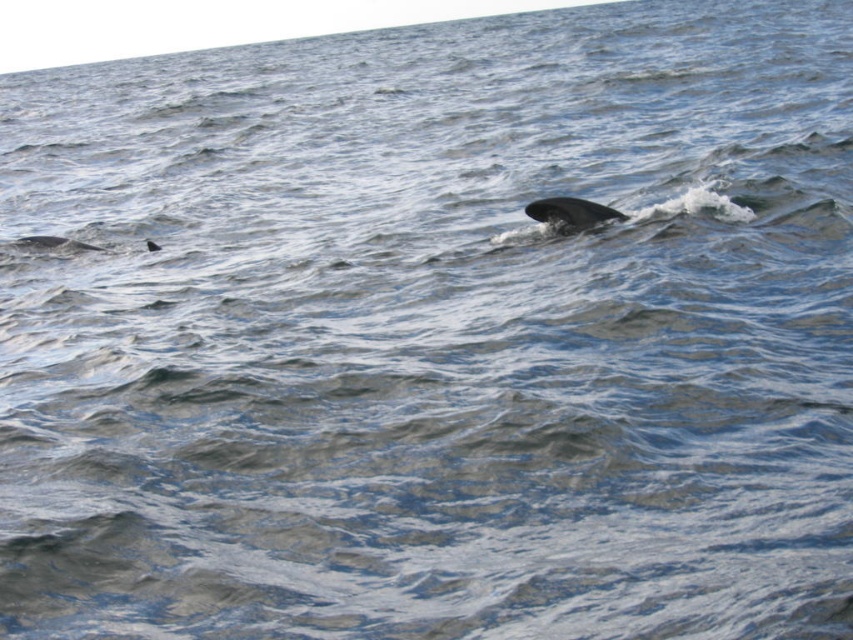
The image size is (853, 640). Find the location of `gray smooth whale at center`. gray smooth whale at center is located at coordinates (570, 212).

Locate an element on the screen. gray smooth whale at center is located at coordinates (570, 212).

I want to click on gray smooth whale at center, so click(570, 212).